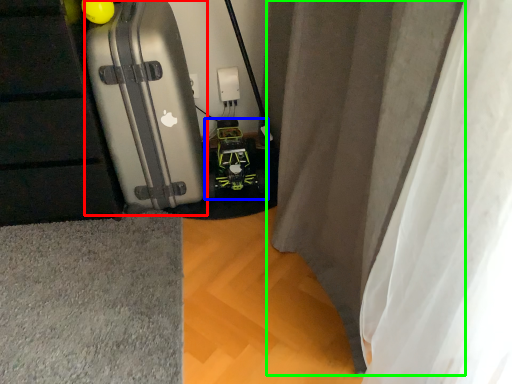
Question: Estimate the real-world distances between objects in this image. Which object is farther from suitcase (highlighted by a red box), toy car (highlighted by a blue box) or curtain (highlighted by a green box)?

Choices:
 (A) toy car
 (B) curtain

Answer: (B)